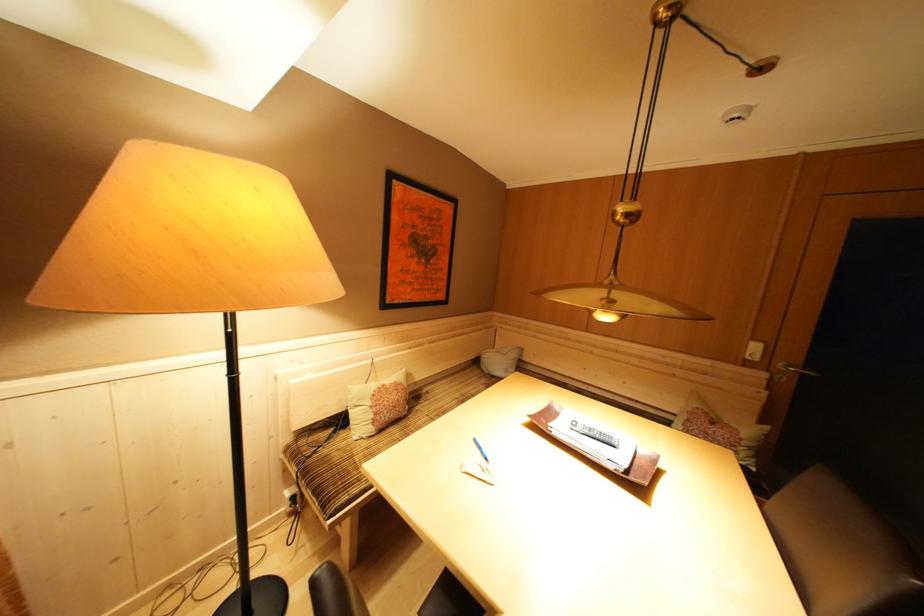
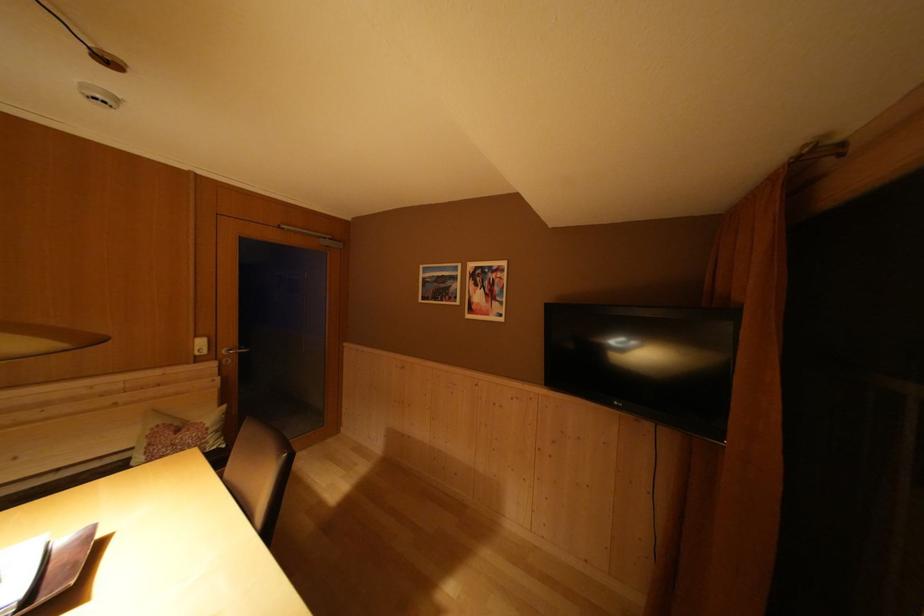
Locate, in the second image, the point that corresponds to pixel 776 384 in the first image.

(226, 371)